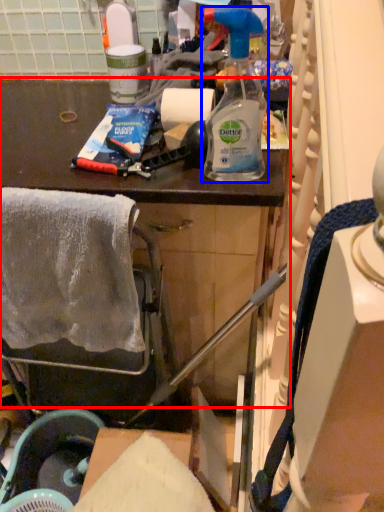
Question: Which object appears farthest to the camera in this image, cabinetry (highlighted by a red box) or bottle (highlighted by a blue box)?

Choices:
 (A) cabinetry
 (B) bottle

Answer: (A)